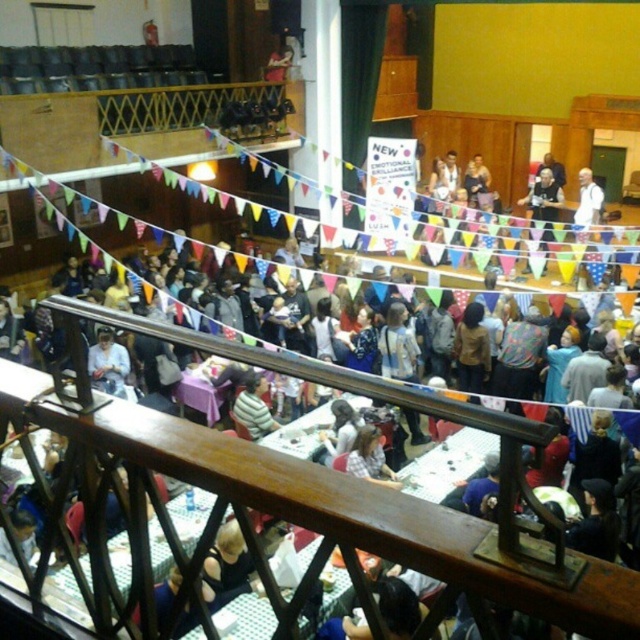
Who is higher up, matte white shirt at center or light brown hair at center?

Positioned higher is matte white shirt at center.

How far apart are matte white shirt at center and light brown hair at center?

matte white shirt at center and light brown hair at center are 3.70 meters apart.

Between point (120, 381) and point (348, 412), which one is positioned behind?

Point (120, 381)

Where is `matte white shirt at center`? This screenshot has width=640, height=640. matte white shirt at center is located at coordinates (108, 364).

Based on the photo, which of these two, plaid shirt at center or light brown hair at center, stands taller?

Standing taller between the two is light brown hair at center.

Looking at this image, between plaid shirt at center and light brown hair at center, which one is positioned higher?

light brown hair at center is higher up.

The height and width of the screenshot is (640, 640). Find the location of `plaid shirt at center`. plaid shirt at center is located at coordinates (369, 458).

Is matte white shirt at center further to camera compared to plaid shirt at center?

That is True.

Where is `matte white shirt at center`? The height and width of the screenshot is (640, 640). matte white shirt at center is located at coordinates (108, 364).